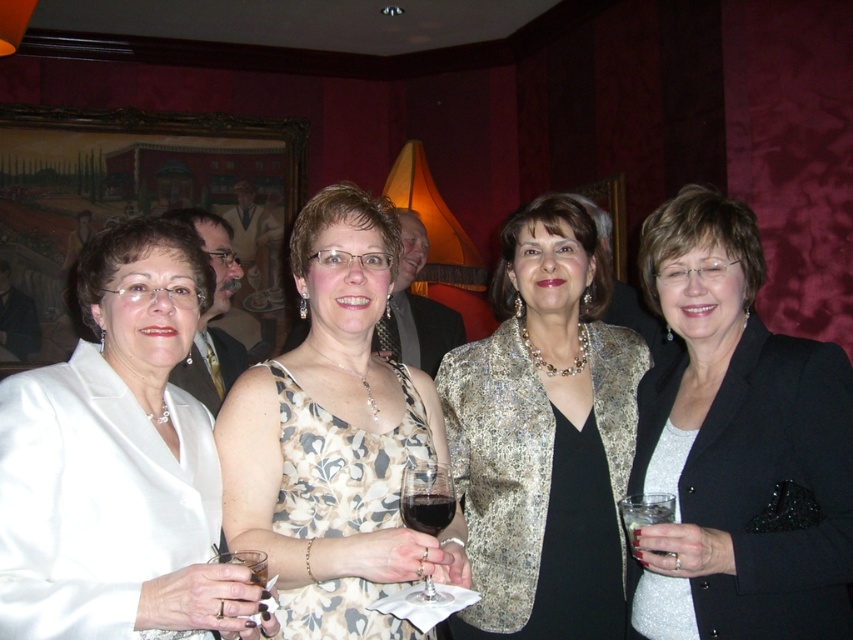
In the scene shown: What are the coordinates of the black satin blazer at center?

The black satin blazer at center is located at coordinates point [738,444].

You are at a social event and want to grab the translucent glass wine glass at center without touching the black satin blazer at center. Is this possible based on their positions?

The black satin blazer at center is to the right of the translucent glass wine glass at center, so there is space between them. You can reach the translucent glass wine glass at center without touching the black satin blazer at center.

You are at a party and want to pour a drink into the clear plastic glass at lower right. However, there is already a clear glass wine glass at lower left underneath it. What should you be cautious about before pouring?

You should be cautious because the clear plastic glass at lower right is positioned over the clear glass wine glass at lower left, so pouring into it might spill onto the glass below.